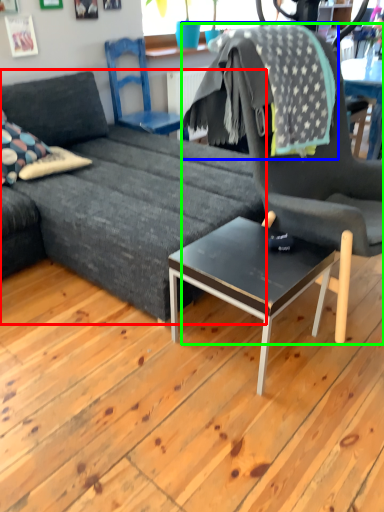
Question: Estimate the real-world distances between objects in this image. Which object is closer to studio couch (highlighted by a red box), blanket (highlighted by a blue box) or chair (highlighted by a green box)?

Choices:
 (A) blanket
 (B) chair

Answer: (B)